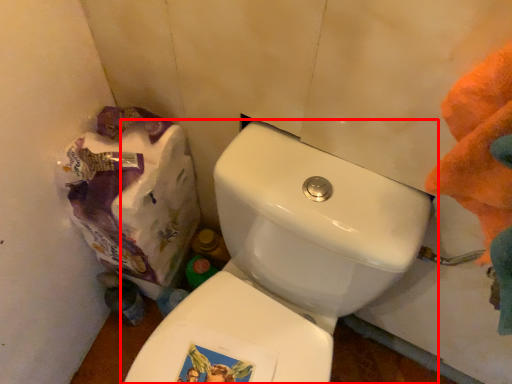
Question: Considering the relative positions of toilet (annotated by the red box) and paper bag in the image provided, where is toilet (annotated by the red box) located with respect to the staircase?

Choices:
 (A) left
 (B) right

Answer: (B)